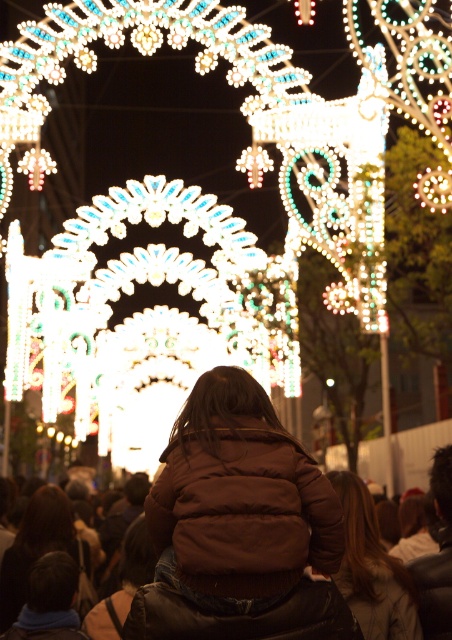
Question: Among these objects, which one is farthest from the camera?

Choices:
 (A) brown puffy jacket at center
 (B) brown leather jacket at lower center
 (C) brown leather jacket at center

Answer: (C)

Question: Does brown leather jacket at center appear on the right side of brown fuzzy coat at lower center?

Choices:
 (A) no
 (B) yes

Answer: (B)

Question: Does brown puffy jacket at center appear under brown fuzzy coat at lower center?

Choices:
 (A) no
 (B) yes

Answer: (A)

Question: Which is farther from the brown leather jacket at center?

Choices:
 (A) brown leather jacket at lower center
 (B) brown fuzzy coat at lower center
 (C) brown puffy jacket at center

Answer: (B)

Question: Does brown leather jacket at lower center have a smaller size compared to brown leather jacket at center?

Choices:
 (A) yes
 (B) no

Answer: (B)

Question: Among these objects, which one is nearest to the camera?

Choices:
 (A) brown leather jacket at center
 (B) brown puffy jacket at center
 (C) brown leather jacket at lower center

Answer: (B)